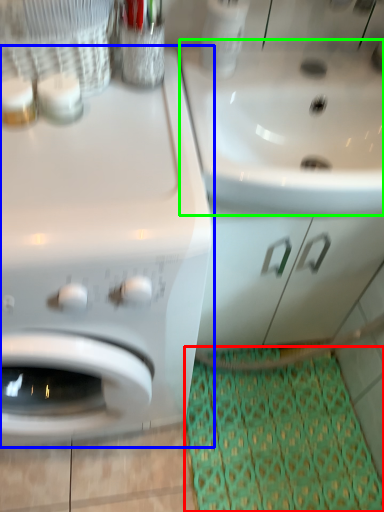
Question: Based on their relative distances, which object is nearer to doormat (highlighted by a red box)? Choose from washing machine (highlighted by a blue box) and sink (highlighted by a green box).

Choices:
 (A) washing machine
 (B) sink

Answer: (A)